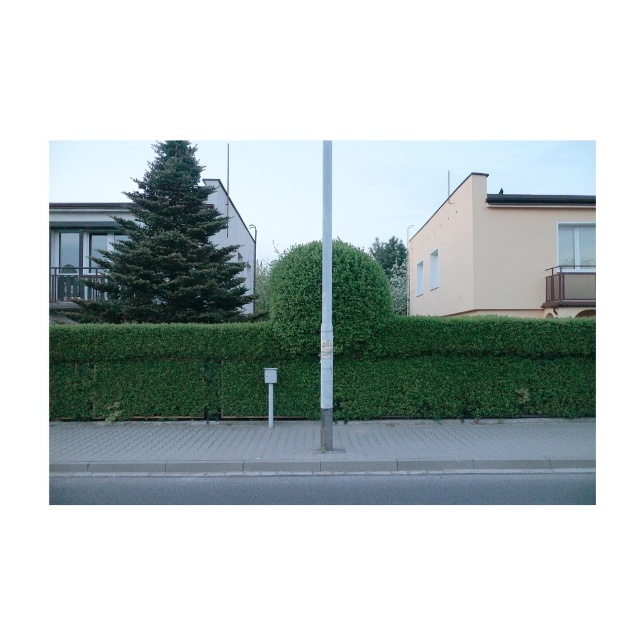
You are standing at the edge of the sidewalk in the suburban street scene. You need to locate the gray asphalt at lower center. According to the coordinates provided, where exactly should you look to find it?

The gray asphalt at lower center is located at the coordinates point (328, 488).

You are standing on the sidewalk in the suburban street scene. There is a green leafy hedge at center marked by the point (469, 369). If you walk straight ahead along the sidewalk, will you eventually reach the hedge?

Yes, because the green leafy hedge at center is represented by point (469, 369), which is along the sidewalk path, so walking straight ahead will lead you to it.

You are walking along the suburban street and want to step onto the gray concrete pavement at center from the green leafy hedge at center. Which direction should you move to reach the pavement?

Since the green leafy hedge at center is closer to you than the gray concrete pavement at center, you should move forward towards the gray concrete pavement at center to reach it.